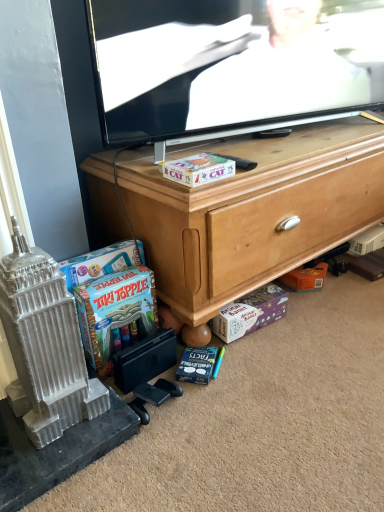
Question: Is black plastic remote control at center positioned before matte cardboard box at center, positioned as the second cash in left-to-right order?

Choices:
 (A) no
 (B) yes

Answer: (A)

Question: Is black plastic remote control at center to the right of matte cardboard box at center, the first cash when ordered from top to bottom, from the viewer's perspective?

Choices:
 (A) no
 (B) yes

Answer: (B)

Question: Is black plastic remote control at center shorter than matte cardboard box at center, which is counted as the 3th cash, starting from the bottom?

Choices:
 (A) yes
 (B) no

Answer: (A)

Question: Is black plastic remote control at center facing away from matte cardboard box at center, positioned as the second cash in left-to-right order?

Choices:
 (A) yes
 (B) no

Answer: (B)

Question: Is black plastic remote control at center directly adjacent to matte cardboard box at center, the first cash when ordered from top to bottom?

Choices:
 (A) yes
 (B) no

Answer: (B)

Question: From the image's perspective, is purple cardboard box at lower center, acting as the third cash starting from the top, located above or below matte cardboard box at center, the first cash when ordered from top to bottom?

Choices:
 (A) above
 (B) below

Answer: (B)

Question: Considering the positions of purple cardboard box at lower center, acting as the third cash starting from the top, and matte cardboard box at center, which appears as the 2th cash when viewed from the right, in the image, is purple cardboard box at lower center, acting as the third cash starting from the top, wider or thinner than matte cardboard box at center, which appears as the 2th cash when viewed from the right,?

Choices:
 (A) wide
 (B) thin

Answer: (B)

Question: Considering the relative positions of purple cardboard box at lower center, the 3th cash positioned from the left, and matte cardboard box at center, which appears as the 2th cash when viewed from the right, in the image provided, is purple cardboard box at lower center, the 3th cash positioned from the left, to the left or to the right of matte cardboard box at center, which appears as the 2th cash when viewed from the right,?

Choices:
 (A) right
 (B) left

Answer: (A)

Question: In terms of size, does purple cardboard box at lower center, which is the first cash from bottom to top, appear bigger or smaller than matte cardboard box at center, which appears as the 2th cash when viewed from the right?

Choices:
 (A) small
 (B) big

Answer: (B)

Question: Which is correct: wooden cabinet at center is inside purple cardboard box at lower center, acting as the third cash starting from the top, or outside of it?

Choices:
 (A) inside
 (B) outside

Answer: (B)

Question: In terms of width, does wooden cabinet at center look wider or thinner when compared to purple cardboard box at lower center, which is the 1th cash from right to left?

Choices:
 (A) wide
 (B) thin

Answer: (A)

Question: Considering the positions of point (256, 189) and point (256, 325), is point (256, 189) closer or farther from the camera than point (256, 325)?

Choices:
 (A) farther
 (B) closer

Answer: (B)

Question: From a real-world perspective, relative to purple cardboard box at lower center, which is the first cash from bottom to top, is wooden cabinet at center vertically above or below?

Choices:
 (A) above
 (B) below

Answer: (A)

Question: Is black plastic remote control at center situated inside blue matte book at lower center or outside?

Choices:
 (A) inside
 (B) outside

Answer: (B)

Question: In terms of width, does black plastic remote control at center look wider or thinner when compared to blue matte book at lower center?

Choices:
 (A) thin
 (B) wide

Answer: (B)